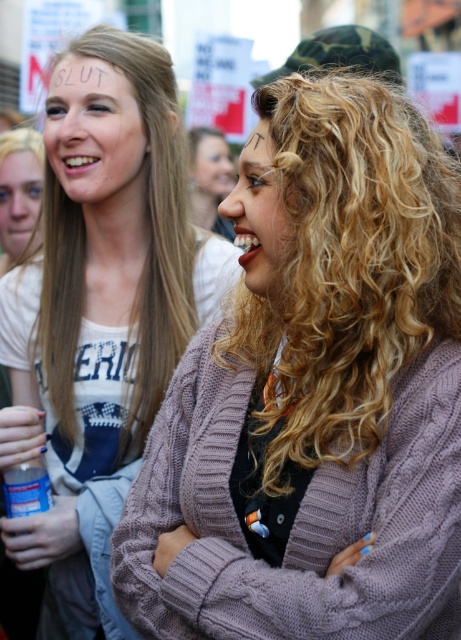
Is smooth skin face at left bigger than smooth skin face at center?

Incorrect, smooth skin face at left is not larger than smooth skin face at center.

Can you confirm if smooth skin face at left is smaller than smooth skin face at center?

Indeed, smooth skin face at left has a smaller size compared to smooth skin face at center.

Between point (22, 243) and point (226, 177), which one is positioned behind?

The point (226, 177) is more distant.

Where is `smooth skin face at left`? smooth skin face at left is located at coordinates (18, 198).

Is curly blonde hair at center below curly hair at center?

Yes.

Who is shorter, curly blonde hair at center or curly hair at center?

curly hair at center is shorter.

Does point (356, 141) come closer to viewer compared to point (259, 189)?

Yes, it is.

Find the location of `curly blonde hair at center`. curly blonde hair at center is located at coordinates (347, 268).

Consider the image. Who is taller, white cable-knit sweater at upper left or smooth skin face at left?

white cable-knit sweater at upper left

Between white cable-knit sweater at upper left and smooth skin face at left, which one is positioned lower?

Positioned lower is white cable-knit sweater at upper left.

Is point (58, 304) farther from viewer compared to point (23, 164)?

That is False.

At what (x,y) coordinates should I click in order to perform the action: click on white cable-knit sweater at upper left. Please return your answer as a coordinate pair (x, y). The image size is (461, 640). Looking at the image, I should click on (100, 310).